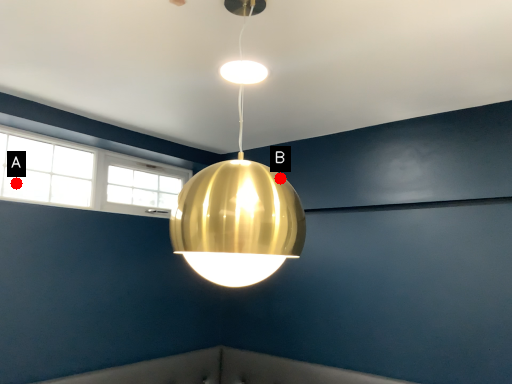
Question: Two points are circled on the image, labeled by A and B beside each circle. Which point is closer to the camera taking this photo?

Choices:
 (A) A is closer
 (B) B is closer

Answer: (B)